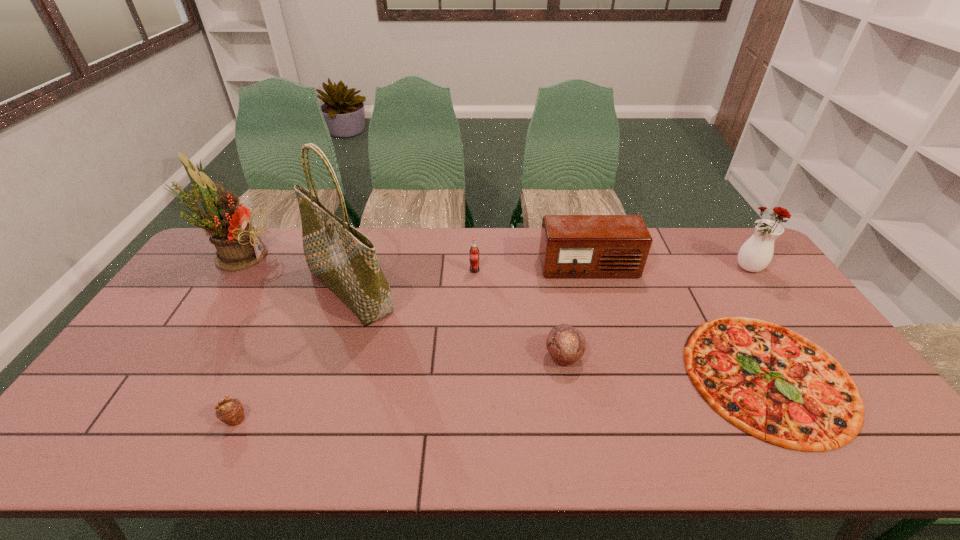
What are the coordinates of `the nearer muffin` in the screenshot? It's located at (230, 411).

At what (x,y) coordinates should I click in order to perform the action: click on pizza. Please return your answer as a coordinate pair (x, y). The width and height of the screenshot is (960, 540). Looking at the image, I should click on (771, 382).

Find the location of `free space located on the right of the tallest object`. free space located on the right of the tallest object is located at coordinates (482, 291).

The height and width of the screenshot is (540, 960). Find the location of `free location located in front of the leftmost object with the fan visible`. free location located in front of the leftmost object with the fan visible is located at coordinates (314, 255).

Identify the location of free space located on the left of the third tallest object. The image size is (960, 540). (707, 269).

Identify the location of vacant space located on the front-facing side of the fourth tallest object. (613, 353).

In order to click on vacant space situated on the label of the soda bottle in this screenshot , I will do `click(474, 326)`.

Where is `vacant space positioned on the back of the sixth tallest object`? The width and height of the screenshot is (960, 540). vacant space positioned on the back of the sixth tallest object is located at coordinates (546, 257).

Where is `vacant point located 0.210m on the right of the seventh tallest object`? The image size is (960, 540). vacant point located 0.210m on the right of the seventh tallest object is located at coordinates (334, 419).

Identify the location of vacant region located 0.190m on the back of the shortest object. This screenshot has width=960, height=540. (708, 276).